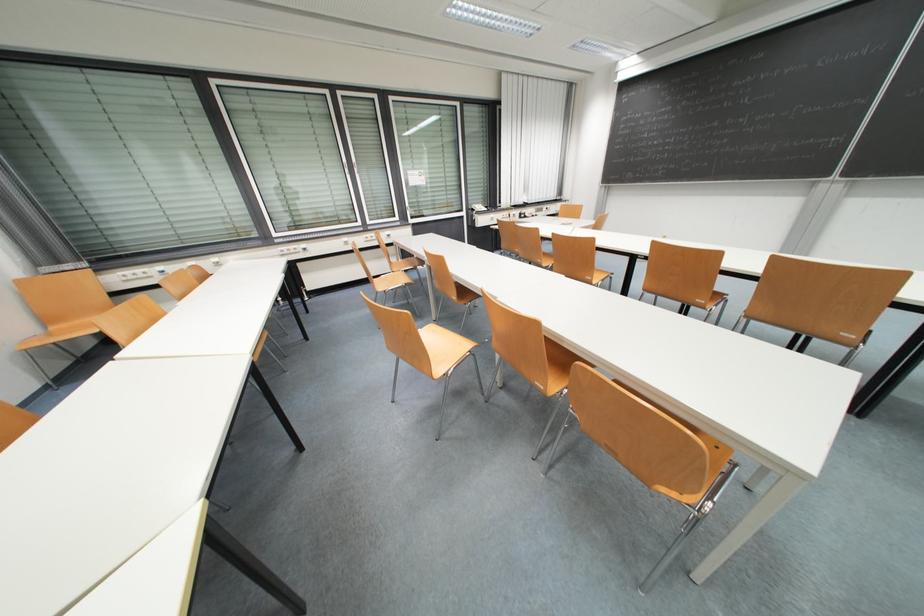
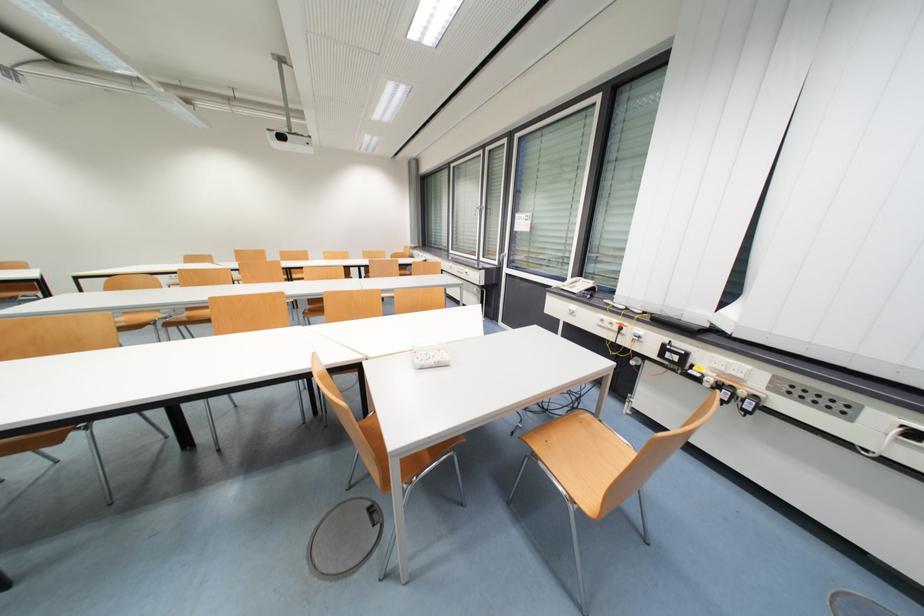
Find the pixel in the second image that matches (496,217) in the first image.

(578, 309)